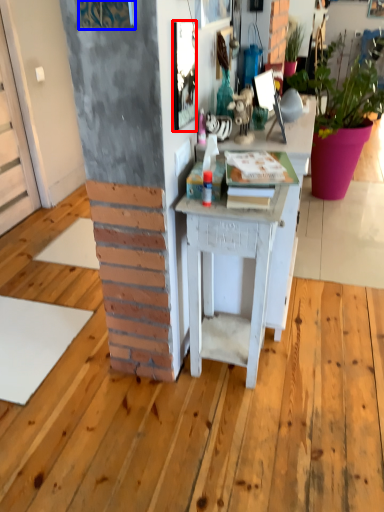
Question: Among these objects, which one is nearest to the camera, picture frame (highlighted by a red box) or picture frame (highlighted by a blue box)?

Choices:
 (A) picture frame
 (B) picture frame

Answer: (B)